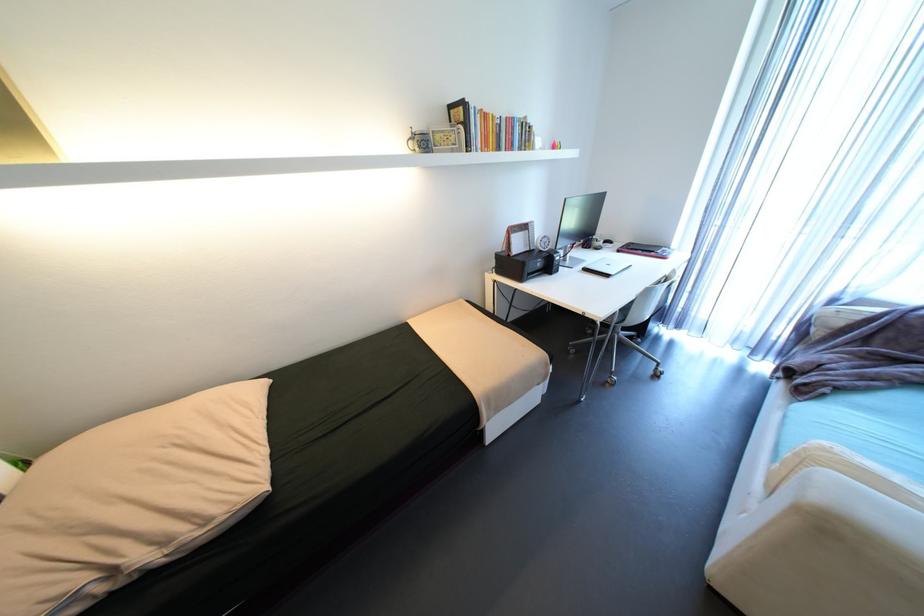
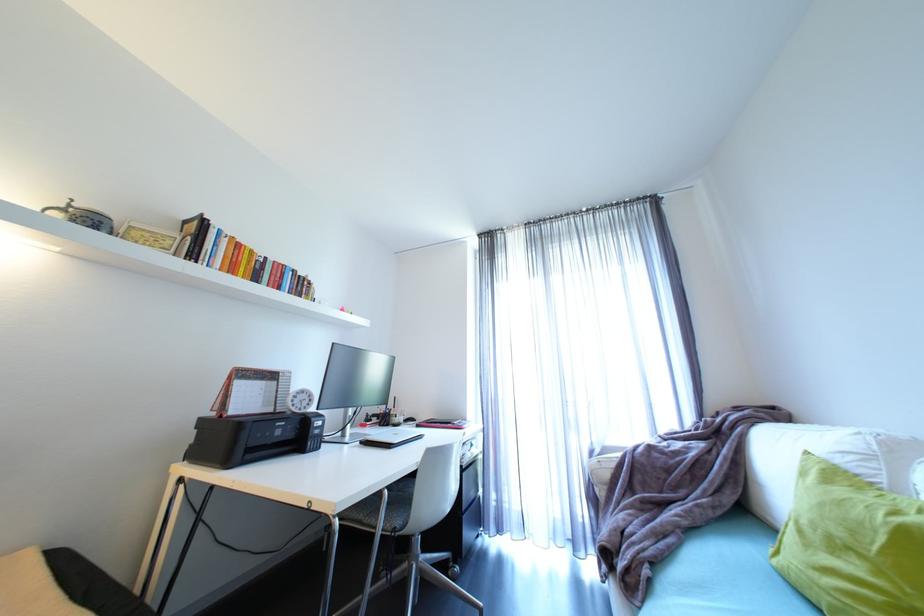
Find the pixel in the second image that matches pixel 553 244 in the first image.

(312, 402)